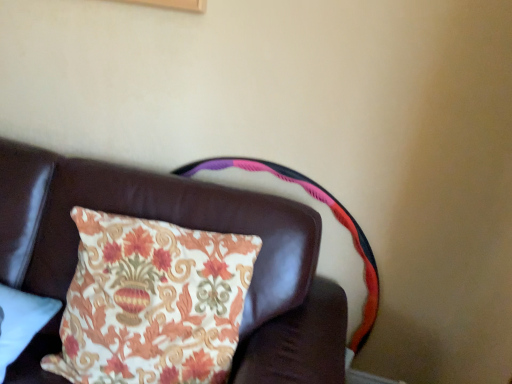
Question: Is floral fabric cushion at upper center oriented away from leather couch cushion at upper left?

Choices:
 (A) no
 (B) yes

Answer: (A)

Question: From a real-world perspective, is floral fabric cushion at upper center below leather couch cushion at upper left?

Choices:
 (A) no
 (B) yes

Answer: (A)

Question: Considering the relative sizes of floral fabric cushion at upper center and leather couch cushion at upper left in the image provided, is floral fabric cushion at upper center shorter than leather couch cushion at upper left?

Choices:
 (A) yes
 (B) no

Answer: (A)

Question: From the image's perspective, is floral fabric cushion at upper center on leather couch cushion at upper left?

Choices:
 (A) no
 (B) yes

Answer: (B)

Question: Does floral fabric cushion at upper center have a greater width compared to leather couch cushion at upper left?

Choices:
 (A) no
 (B) yes

Answer: (A)

Question: Choose the correct answer: Is floral fabric pillow at lower left inside floral fabric cushion at upper center or outside it?

Choices:
 (A) outside
 (B) inside

Answer: (A)

Question: From the image's perspective, is floral fabric pillow at lower left above or below floral fabric cushion at upper center?

Choices:
 (A) below
 (B) above

Answer: (A)

Question: From their relative heights in the image, would you say floral fabric pillow at lower left is taller or shorter than floral fabric cushion at upper center?

Choices:
 (A) tall
 (B) short

Answer: (B)

Question: Considering the positions of point (10, 329) and point (340, 253), is point (10, 329) closer or farther from the camera than point (340, 253)?

Choices:
 (A) farther
 (B) closer

Answer: (B)

Question: Do you think floral fabric cushion at upper center is within leather couch cushion at upper left, or outside of it?

Choices:
 (A) inside
 (B) outside

Answer: (B)

Question: Is floral fabric cushion at upper center in front of or behind leather couch cushion at upper left in the image?

Choices:
 (A) front
 (B) behind

Answer: (B)

Question: From their relative heights in the image, would you say floral fabric cushion at upper center is taller or shorter than leather couch cushion at upper left?

Choices:
 (A) tall
 (B) short

Answer: (B)

Question: From the image's perspective, is floral fabric cushion at upper center located above or below leather couch cushion at upper left?

Choices:
 (A) below
 (B) above

Answer: (B)

Question: In the image, is floral fabric pillow at lower left positioned in front of or behind leather couch cushion at upper left?

Choices:
 (A) behind
 (B) front

Answer: (A)

Question: From the image's perspective, is floral fabric pillow at lower left located above or below leather couch cushion at upper left?

Choices:
 (A) below
 (B) above

Answer: (B)